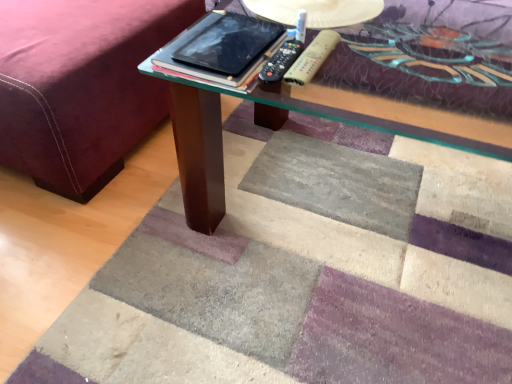
Measure the distance between point (336, 32) and camera.

The depth of point (336, 32) is 5.43 feet.

Measure the distance between point (51, 152) and camera.

1.13 meters.

Identify the location of black glossy tablet at center. point(229,44).

Considering the relative positions of black plastic remote at center, which appears as the 2th remote when viewed from the right, and velvet maroon bed frame at lower left in the image provided, is black plastic remote at center, which appears as the 2th remote when viewed from the right, to the right of velvet maroon bed frame at lower left from the viewer's perspective?

Yes.

Consider the image. From the image's perspective, between black plastic remote at center, placed as the 1th remote when sorted from left to right, and velvet maroon bed frame at lower left, which one is located above?

velvet maroon bed frame at lower left, from the image's perspective.

Would you consider black plastic remote at center, placed as the 1th remote when sorted from left to right, to be distant from velvet maroon bed frame at lower left?

That's not correct — black plastic remote at center, placed as the 1th remote when sorted from left to right, is a little close to velvet maroon bed frame at lower left.

Is black plastic remote at center, which appears as the 2th remote when viewed from the right, facing towards velvet maroon bed frame at lower left?

No, black plastic remote at center, which appears as the 2th remote when viewed from the right, is not aimed at velvet maroon bed frame at lower left.

Is wooden textured remote at center, placed as the second remote when sorted from left to right, surrounded by velvet maroon bed frame at lower left?

No, velvet maroon bed frame at lower left does not contain wooden textured remote at center, placed as the second remote when sorted from left to right.

Looking at this image, is velvet maroon bed frame at lower left shorter than wooden textured remote at center, placed as the second remote when sorted from left to right?

No.

Which object is positioned more to the left, velvet maroon bed frame at lower left or wooden textured remote at center, the 1th remote from the right?

From the viewer's perspective, velvet maroon bed frame at lower left appears more on the left side.

Is velvet maroon bed frame at lower left thinner than wooden textured remote at center, placed as the second remote when sorted from left to right?

Incorrect, the width of velvet maroon bed frame at lower left is not less than that of wooden textured remote at center, placed as the second remote when sorted from left to right.

Considering the positions of point (269, 80) and point (242, 38), is point (269, 80) closer or farther from the camera than point (242, 38)?

Clearly, point (269, 80) is more distant from the camera than point (242, 38).

Locate an element on the screen. The image size is (512, 384). tablet computer in front of the black plastic remote at center, which appears as the 2th remote when viewed from the right is located at coordinates (229, 44).

Does black plastic remote at center, placed as the 1th remote when sorted from left to right, have a lesser height compared to black glossy tablet at center?

In fact, black plastic remote at center, placed as the 1th remote when sorted from left to right, may be taller than black glossy tablet at center.

From a real-world perspective, does black glossy tablet at center sit lower than velvet maroon bed frame at lower left?

No, from a real-world perspective, black glossy tablet at center is not beneath velvet maroon bed frame at lower left.

Is black glossy tablet at center wider or thinner than velvet maroon bed frame at lower left?

black glossy tablet at center is thinner than velvet maroon bed frame at lower left.

Are black glossy tablet at center and velvet maroon bed frame at lower left located far from each other?

No, black glossy tablet at center is not far from velvet maroon bed frame at lower left.

Which object is further away from the camera taking this photo, wooden textured remote at center, the 1th remote from the right, or black plastic remote at center, placed as the 1th remote when sorted from left to right?

wooden textured remote at center, the 1th remote from the right, is more distant.

In terms of size, does wooden textured remote at center, the 1th remote from the right, appear bigger or smaller than black plastic remote at center, placed as the 1th remote when sorted from left to right?

Considering their sizes, wooden textured remote at center, the 1th remote from the right, takes up less space than black plastic remote at center, placed as the 1th remote when sorted from left to right.

Is wooden textured remote at center, the 1th remote from the right, not inside black plastic remote at center, placed as the 1th remote when sorted from left to right?

That's correct, wooden textured remote at center, the 1th remote from the right, is outside of black plastic remote at center, placed as the 1th remote when sorted from left to right.

In the scene shown: How much distance is there between wooden textured remote at center, the 1th remote from the right, and black plastic remote at center, placed as the 1th remote when sorted from left to right?

15.35 inches.

Does velvet maroon bed frame at lower left have a smaller size compared to black glossy tablet at center?

No, velvet maroon bed frame at lower left is not smaller than black glossy tablet at center.

Is velvet maroon bed frame at lower left further to camera compared to black glossy tablet at center?

Yes, velvet maroon bed frame at lower left is behind black glossy tablet at center.

Would you say velvet maroon bed frame at lower left is a long distance from black glossy tablet at center?

No, there isn't a large distance between velvet maroon bed frame at lower left and black glossy tablet at center.

Is velvet maroon bed frame at lower left oriented away from black glossy tablet at center?

No, velvet maroon bed frame at lower left is not facing the opposite direction of black glossy tablet at center.

This screenshot has height=384, width=512. In order to click on the 2nd remote behind the black glossy tablet at center in this screenshot , I will do `click(312, 58)`.

Which object is closer to the camera, wooden textured remote at center, the 1th remote from the right, or black glossy tablet at center?

Positioned in front is black glossy tablet at center.

Could you tell me if wooden textured remote at center, placed as the second remote when sorted from left to right, is turned towards black glossy tablet at center?

No, wooden textured remote at center, placed as the second remote when sorted from left to right, is not aimed at black glossy tablet at center.

Considering the sizes of objects wooden textured remote at center, placed as the second remote when sorted from left to right, and black glossy tablet at center in the image provided, who is wider, wooden textured remote at center, placed as the second remote when sorted from left to right, or black glossy tablet at center?

black glossy tablet at center is wider.

Where is `the 1st remote to the right when counting from the velvet maroon bed frame at lower left`? The image size is (512, 384). the 1st remote to the right when counting from the velvet maroon bed frame at lower left is located at coordinates (281, 60).

From the image's perspective, which remote is the 1st one below the velvet maroon bed frame at lower left? Please provide its 2D coordinates.

[(312, 58)]

When comparing their distances from wooden textured remote at center, placed as the second remote when sorted from left to right, does black glossy tablet at center or velvet maroon bed frame at lower left seem closer?

black glossy tablet at center.

Consider the image. Based on their spatial positions, is velvet maroon bed frame at lower left or black glossy tablet at center closer to wooden textured remote at center, placed as the second remote when sorted from left to right?

black glossy tablet at center.

Estimate the real-world distances between objects in this image. Which object is further from black plastic remote at center, placed as the 1th remote when sorted from left to right, velvet maroon bed frame at lower left or black glossy tablet at center?

velvet maroon bed frame at lower left is positioned further to the anchor black plastic remote at center, placed as the 1th remote when sorted from left to right.

Looking at the image, which one is located closer to black glossy tablet at center, black plastic remote at center, placed as the 1th remote when sorted from left to right, or velvet maroon bed frame at lower left?

black plastic remote at center, placed as the 1th remote when sorted from left to right, is positioned closer to the anchor black glossy tablet at center.

Based on their spatial positions, is wooden textured remote at center, the 1th remote from the right, or black plastic remote at center, placed as the 1th remote when sorted from left to right, further from velvet maroon bed frame at lower left?

black plastic remote at center, placed as the 1th remote when sorted from left to right, lies further to velvet maroon bed frame at lower left than the other object.

Based on their spatial positions, is black glossy tablet at center or black plastic remote at center, which appears as the 2th remote when viewed from the right, further from velvet maroon bed frame at lower left?

black plastic remote at center, which appears as the 2th remote when viewed from the right, is further to velvet maroon bed frame at lower left.

From the image, which object appears to be nearer to black plastic remote at center, placed as the 1th remote when sorted from left to right, wooden textured remote at center, placed as the second remote when sorted from left to right, or black glossy tablet at center?

black glossy tablet at center is positioned closer to the anchor black plastic remote at center, placed as the 1th remote when sorted from left to right.

When comparing their distances from wooden textured remote at center, placed as the second remote when sorted from left to right, does velvet maroon bed frame at lower left or black plastic remote at center, which appears as the 2th remote when viewed from the right, seem closer?

black plastic remote at center, which appears as the 2th remote when viewed from the right, lies closer to wooden textured remote at center, placed as the second remote when sorted from left to right, than the other object.

At what (x,y) coordinates should I click in order to perform the action: click on tablet computer between velvet maroon bed frame at lower left and black plastic remote at center, which appears as the 2th remote when viewed from the right. Please return your answer as a coordinate pair (x, y). The image size is (512, 384). Looking at the image, I should click on (229, 44).

Locate an element on the screen. The height and width of the screenshot is (384, 512). remote situated between velvet maroon bed frame at lower left and wooden textured remote at center, placed as the second remote when sorted from left to right, from left to right is located at coordinates (281, 60).

This screenshot has height=384, width=512. What are the coordinates of `tablet computer between velvet maroon bed frame at lower left and wooden textured remote at center, placed as the second remote when sorted from left to right, in the horizontal direction` in the screenshot? It's located at point(229,44).

Find the location of `remote between black glossy tablet at center and wooden textured remote at center, the 1th remote from the right, from left to right`. remote between black glossy tablet at center and wooden textured remote at center, the 1th remote from the right, from left to right is located at coordinates (281, 60).